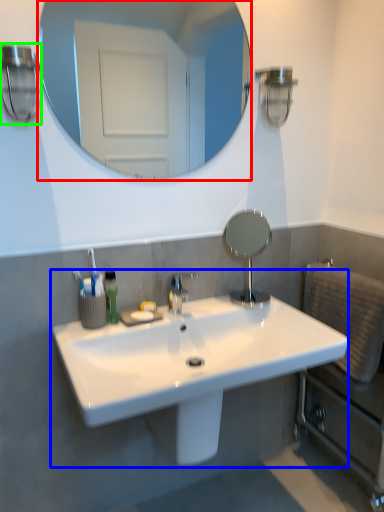
Question: Based on their relative distances, which object is farther from mirror (highlighted by a red box)? Choose from sink (highlighted by a blue box) and light fixture (highlighted by a green box).

Choices:
 (A) sink
 (B) light fixture

Answer: (A)